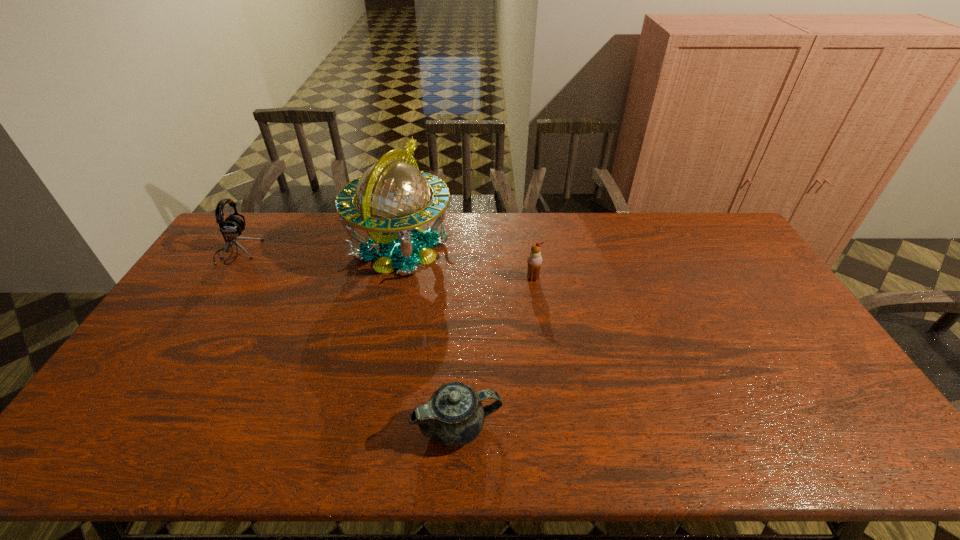
Where is `earphone located at the far edge`? earphone located at the far edge is located at coordinates (232, 227).

Find the location of a particular element. The image size is (960, 540). object located in the near edge section of the desktop is located at coordinates (454, 416).

Identify the location of object at the left edge. The image size is (960, 540). (232, 227).

At what (x,y) coordinates should I click in order to perform the action: click on object present at the far left corner. Please return your answer as a coordinate pair (x, y). The height and width of the screenshot is (540, 960). Looking at the image, I should click on (232, 227).

Identify the location of free space at the far edge. (590, 243).

Locate an element on the screen. Image resolution: width=960 pixels, height=540 pixels. blank space at the near edge of the desktop is located at coordinates (276, 457).

Where is `vacant space at the left edge of the desktop`? The image size is (960, 540). vacant space at the left edge of the desktop is located at coordinates (197, 349).

Where is `blank space at the right edge of the desktop`? blank space at the right edge of the desktop is located at coordinates tap(730, 255).

Identify the location of vacant area between the leftmost object and the tallest object. (319, 251).

Locate an element on the screen. This screenshot has height=540, width=960. free space that is in between the rightmost object and the globe is located at coordinates (468, 264).